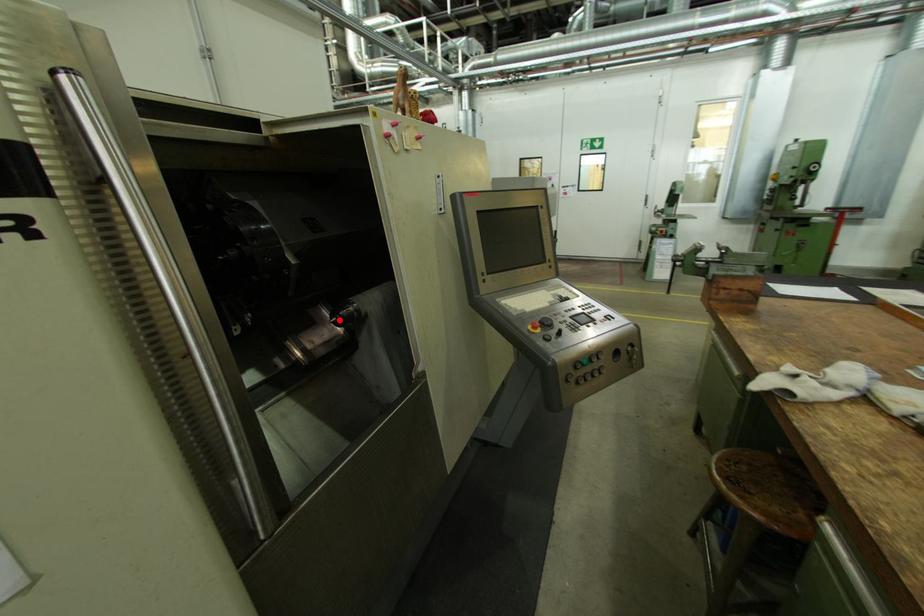
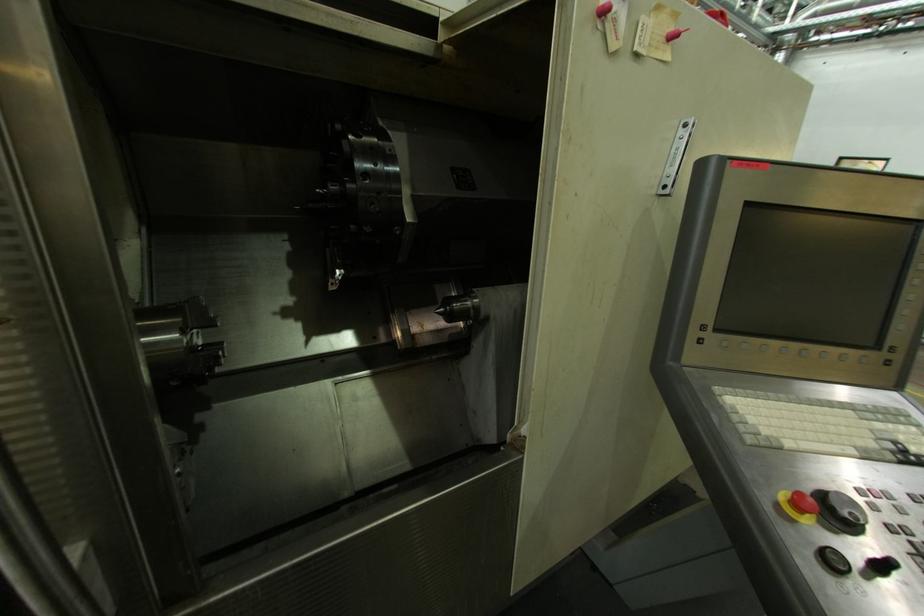
In the second image, find the point that corresponds to the highlighted location in the first image.

(448, 310)